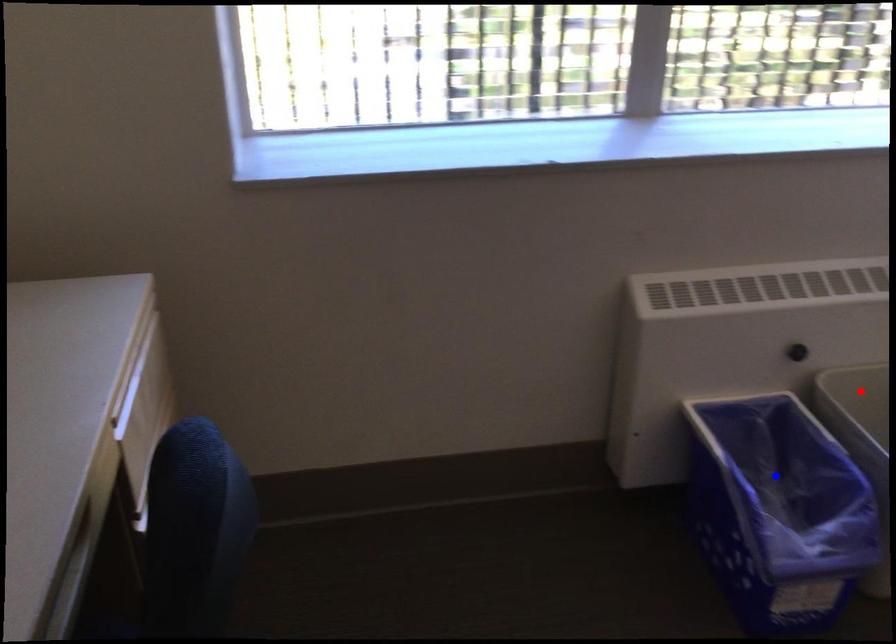
Question: Two points are marked on the image. Which point is closer to the camera?

Choices:
 (A) Blue point is closer.
 (B) Red point is closer.

Answer: (A)